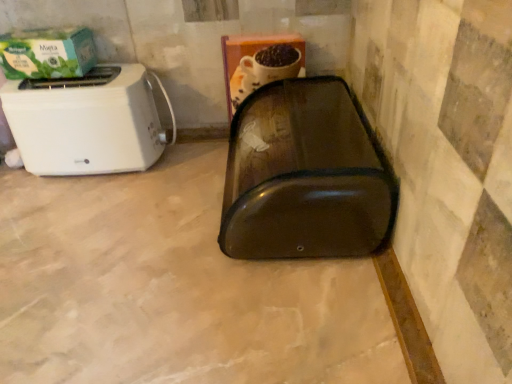
Question: Is the position of green matte box at upper left more distant than that of transparent plastic bread bin at center?

Choices:
 (A) yes
 (B) no

Answer: (A)

Question: Is green matte box at upper left not inside transparent plastic bread bin at center?

Choices:
 (A) no
 (B) yes

Answer: (B)

Question: Is green matte box at upper left oriented towards transparent plastic bread bin at center?

Choices:
 (A) no
 (B) yes

Answer: (A)

Question: Are green matte box at upper left and transparent plastic bread bin at center making contact?

Choices:
 (A) no
 (B) yes

Answer: (A)

Question: From the image's perspective, would you say green matte box at upper left is positioned over transparent plastic bread bin at center?

Choices:
 (A) no
 (B) yes

Answer: (B)

Question: Is green matte box at upper left at the left side of transparent plastic bread bin at center?

Choices:
 (A) yes
 (B) no

Answer: (A)

Question: Can you confirm if white plastic toaster at left is positioned to the left of transparent plastic bread bin at center?

Choices:
 (A) yes
 (B) no

Answer: (B)

Question: From the image's perspective, does white plastic toaster at left appear lower than transparent plastic bread bin at center?

Choices:
 (A) no
 (B) yes

Answer: (A)

Question: Considering the relative sizes of white plastic toaster at left and transparent plastic bread bin at center in the image provided, is white plastic toaster at left thinner than transparent plastic bread bin at center?

Choices:
 (A) no
 (B) yes

Answer: (B)

Question: Considering the relative sizes of white plastic toaster at left and transparent plastic bread bin at center in the image provided, is white plastic toaster at left smaller than transparent plastic bread bin at center?

Choices:
 (A) yes
 (B) no

Answer: (A)

Question: Is white plastic toaster at left not inside transparent plastic bread bin at center?

Choices:
 (A) yes
 (B) no

Answer: (A)

Question: Considering the relative sizes of white plastic toaster at left and transparent plastic bread bin at center in the image provided, is white plastic toaster at left shorter than transparent plastic bread bin at center?

Choices:
 (A) yes
 (B) no

Answer: (A)

Question: Can you confirm if green matte box at upper left is wider than white plastic toaster at left?

Choices:
 (A) yes
 (B) no

Answer: (B)